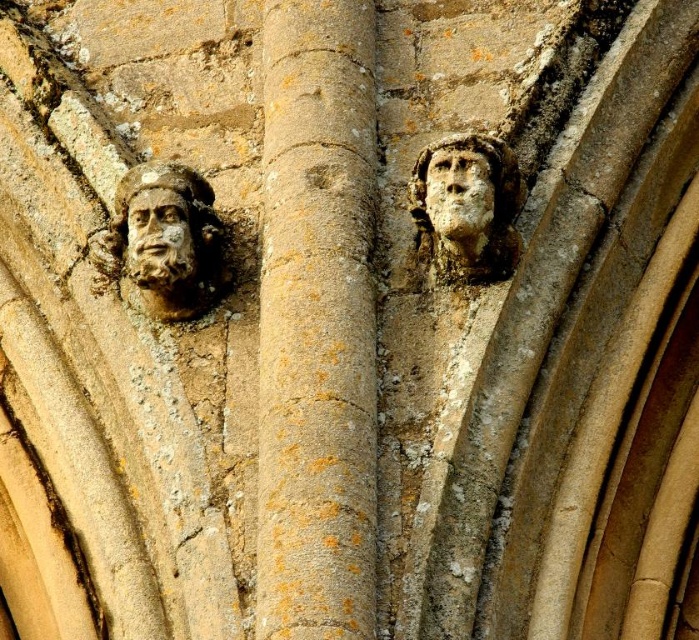
Based on the photo, can you confirm if weathered stone face at upper right is wider than carved stone face at upper right?

Yes, weathered stone face at upper right is wider than carved stone face at upper right.

Is weathered stone face at upper right to the right of carved stone face at upper right from the viewer's perspective?

Indeed, weathered stone face at upper right is positioned on the right side of carved stone face at upper right.

Is point (504, 196) more distant than point (468, 243)?

Yes.

What are the coordinates of `weathered stone face at upper right` in the screenshot? It's located at (466, 208).

In the scene shown: Does brown stone column at center have a greater height compared to matte stone face at left?

Indeed, brown stone column at center has a greater height compared to matte stone face at left.

Can you confirm if brown stone column at center is positioned to the left of matte stone face at left?

In fact, brown stone column at center is to the right of matte stone face at left.

Between point (329, 316) and point (157, 198), which one is positioned behind?

The point (157, 198) is behind.

You are a GUI agent. You are given a task and a screenshot of the screen. Output one action in this format:
    pyautogui.click(x=<x>, y=<y>)
    Task: Click on the brown stone column at center
    
    Given the screenshot: What is the action you would take?
    pyautogui.click(x=317, y=323)

Can you confirm if weathered stone face at upper right is smaller than carved stone face at left?

No.

Does weathered stone face at upper right have a greater width compared to carved stone face at left?

Yes, weathered stone face at upper right is wider than carved stone face at left.

Who is more distant from viewer, (428, 234) or (182, 244)?

Positioned behind is point (428, 234).

Where is `weathered stone face at upper right`? weathered stone face at upper right is located at coordinates (466, 208).